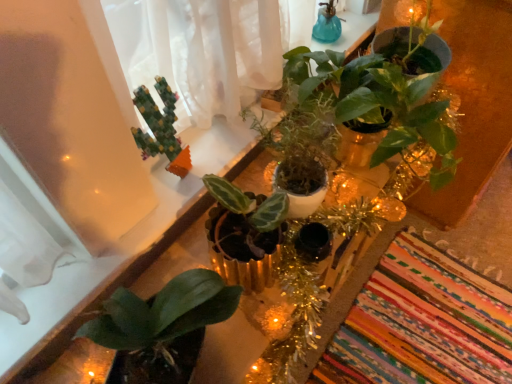
Question: Is green matte plant at upper center, placed as the 1th houseplant when sorted from right to left, smaller than multicolored woven mat at lower right?

Choices:
 (A) yes
 (B) no

Answer: (B)

Question: From a real-world perspective, is green matte plant at upper center, placed as the 1th houseplant when sorted from right to left, positioned under multicolored woven mat at lower right based on gravity?

Choices:
 (A) yes
 (B) no

Answer: (B)

Question: Considering the relative positions of green matte plant at upper center, the 3th houseplant in the left-to-right sequence, and multicolored woven mat at lower right in the image provided, is green matte plant at upper center, the 3th houseplant in the left-to-right sequence, in front of multicolored woven mat at lower right?

Choices:
 (A) no
 (B) yes

Answer: (B)

Question: Does green matte plant at upper center, the 3th houseplant in the left-to-right sequence, have a lesser width compared to multicolored woven mat at lower right?

Choices:
 (A) no
 (B) yes

Answer: (B)

Question: From the image's perspective, is green matte plant at upper center, placed as the 1th houseplant when sorted from right to left, beneath multicolored woven mat at lower right?

Choices:
 (A) yes
 (B) no

Answer: (B)

Question: Do you think blue glass vase at upper center is within green matte plant at upper center, placed as the 1th houseplant when sorted from right to left, or outside of it?

Choices:
 (A) inside
 (B) outside

Answer: (B)

Question: From a real-world perspective, is blue glass vase at upper center physically located above or below green matte plant at upper center, the 3th houseplant in the left-to-right sequence?

Choices:
 (A) below
 (B) above

Answer: (B)

Question: Is blue glass vase at upper center taller or shorter than green matte plant at upper center, the 3th houseplant in the left-to-right sequence?

Choices:
 (A) short
 (B) tall

Answer: (A)

Question: From the image's perspective, relative to green matte plant at upper center, placed as the 1th houseplant when sorted from right to left, is blue glass vase at upper center above or below?

Choices:
 (A) above
 (B) below

Answer: (A)

Question: Considering the positions of green matte plant at upper center, placed as the 1th houseplant when sorted from right to left, and blue glass vase at upper center in the image, is green matte plant at upper center, placed as the 1th houseplant when sorted from right to left, taller or shorter than blue glass vase at upper center?

Choices:
 (A) short
 (B) tall

Answer: (B)

Question: Looking at the image, does green matte plant at upper center, the 3th houseplant in the left-to-right sequence, seem bigger or smaller compared to blue glass vase at upper center?

Choices:
 (A) big
 (B) small

Answer: (A)

Question: Considering the positions of green matte plant at upper center, placed as the 1th houseplant when sorted from right to left, and blue glass vase at upper center in the image, is green matte plant at upper center, placed as the 1th houseplant when sorted from right to left, wider or thinner than blue glass vase at upper center?

Choices:
 (A) wide
 (B) thin

Answer: (A)

Question: Is green matte plant at upper center, placed as the 1th houseplant when sorted from right to left, situated inside blue glass vase at upper center or outside?

Choices:
 (A) outside
 (B) inside

Answer: (A)

Question: Based on their sizes in the image, would you say green matte plant at center, the 2th houseplant positioned from the right, is bigger or smaller than blue glass vase at upper center?

Choices:
 (A) small
 (B) big

Answer: (B)

Question: From the image's perspective, is green matte plant at center, the 2th houseplant positioned from the right, located above or below blue glass vase at upper center?

Choices:
 (A) below
 (B) above

Answer: (A)